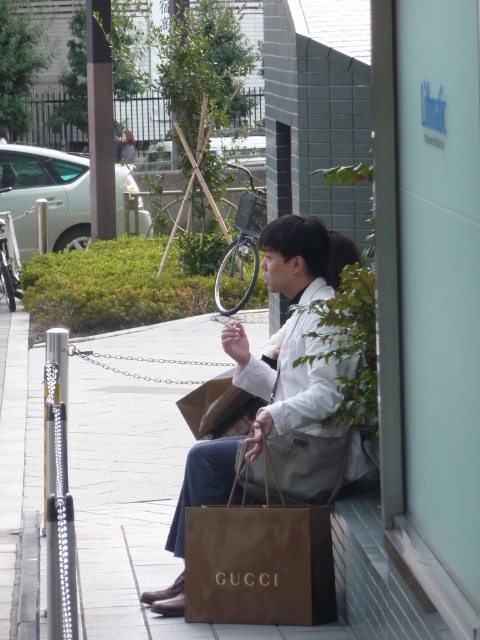
Question: Which of the following is the closest to the observer?

Choices:
 (A) brown paper bag at center
 (B) white matte jacket at center

Answer: (B)

Question: Is white matte jacket at center to the right of matte brown paper bag at center from the viewer's perspective?

Choices:
 (A) no
 (B) yes

Answer: (B)

Question: Which point is farther to the camera?

Choices:
 (A) (131, 144)
 (B) (316, 291)
 (C) (328, 513)

Answer: (A)

Question: Does white matte jacket at center have a smaller size compared to matte brown paper bag at center?

Choices:
 (A) no
 (B) yes

Answer: (A)

Question: Among these objects, which one is nearest to the camera?

Choices:
 (A) matte brown paper bag at center
 (B) white matte jacket at center
 (C) brown paper bag at center

Answer: (B)

Question: Observing the image, what is the correct spatial positioning of white matte jacket at center in reference to brown paper bag at center?

Choices:
 (A) below
 (B) above

Answer: (B)